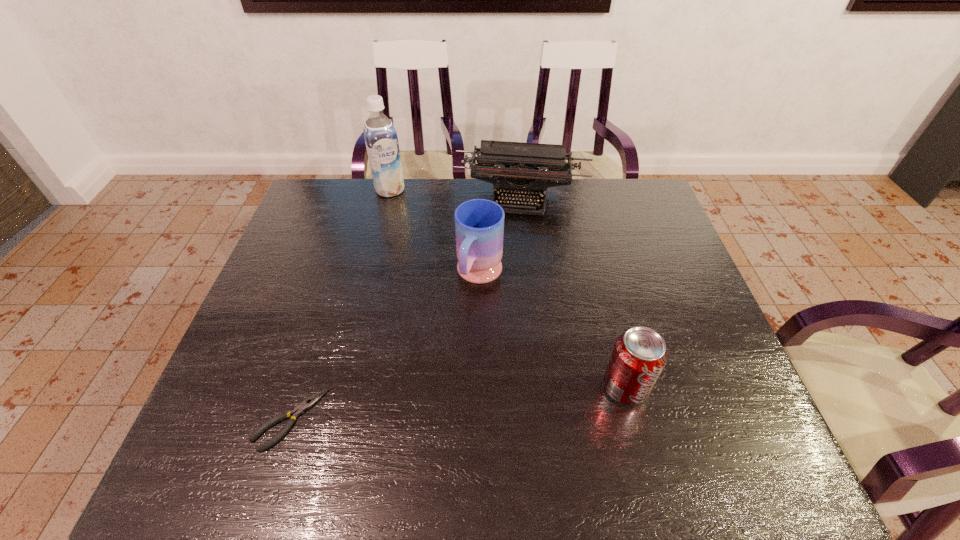
Identify the location of empty space that is in between the soda can and the typewriter. This screenshot has width=960, height=540. (573, 292).

Image resolution: width=960 pixels, height=540 pixels. Find the location of `blank region between the tallest object and the typewriter`. blank region between the tallest object and the typewriter is located at coordinates [x=456, y=194].

What are the coordinates of `free space that is in between the typewriter and the shortest object` in the screenshot? It's located at (406, 308).

Where is `free space between the typewriter and the shortest object`? Image resolution: width=960 pixels, height=540 pixels. free space between the typewriter and the shortest object is located at coordinates (406, 308).

Find the location of a particular element. Image resolution: width=960 pixels, height=540 pixels. free space between the soda can and the typewriter is located at coordinates (573, 292).

Identify the location of object that stands as the third closest to the pliers. The height and width of the screenshot is (540, 960). (510, 166).

Select which object is the fourth closest to the typewriter. Please provide its 2D coordinates. Your answer should be formatted as a tuple, i.e. [(x, y)], where the tuple contains the x and y coordinates of a point satisfying the conditions above.

[(299, 410)]